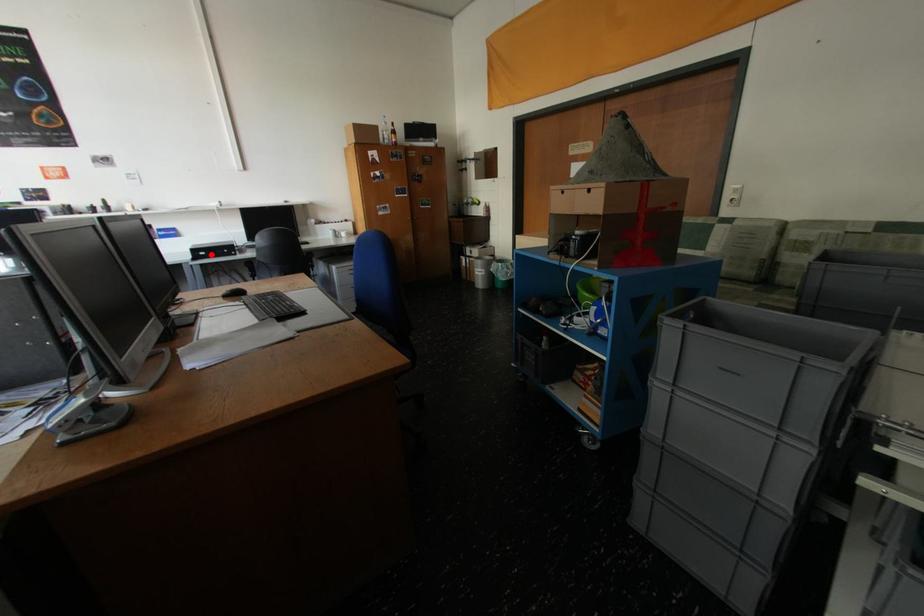
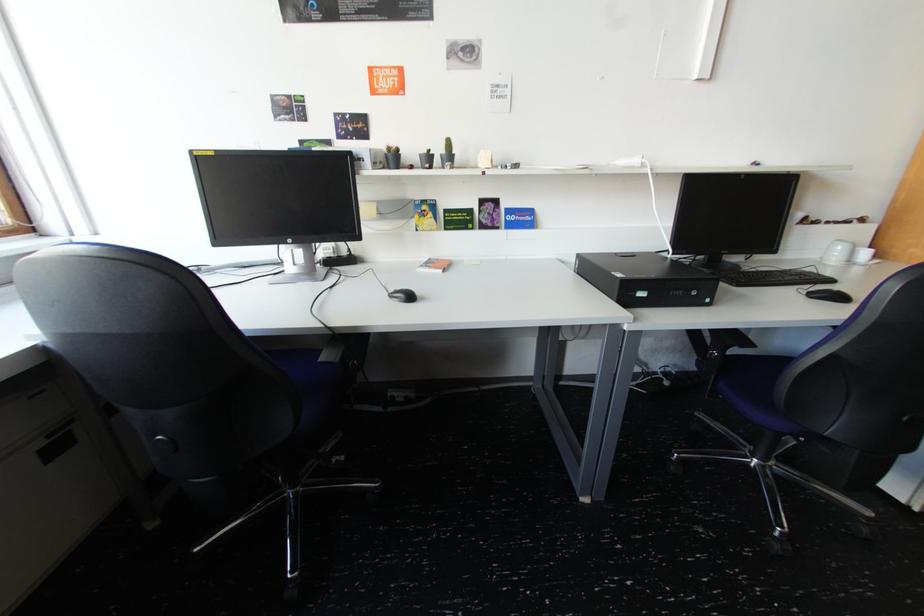
Find the pixel in the second image that matches the highlighted location in the first image.

(650, 294)